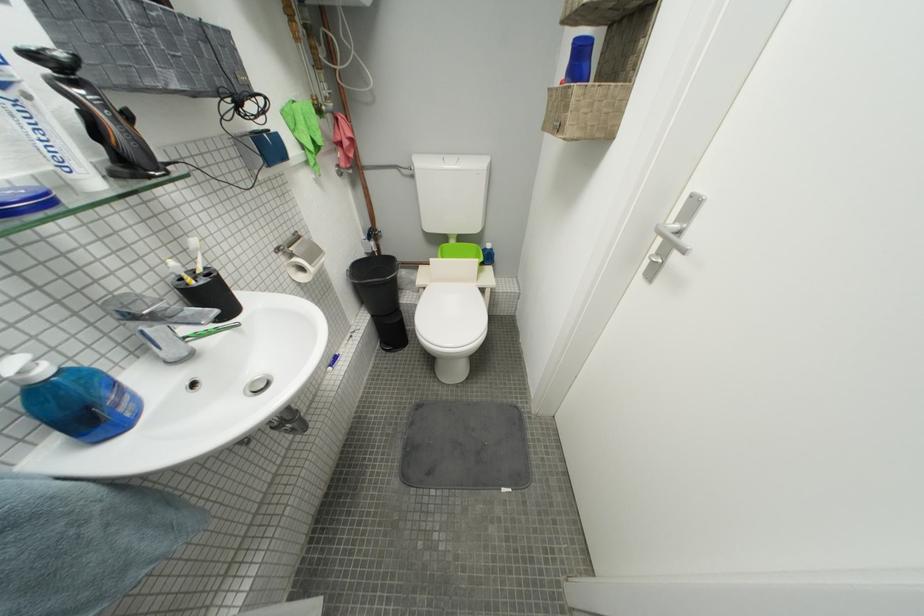
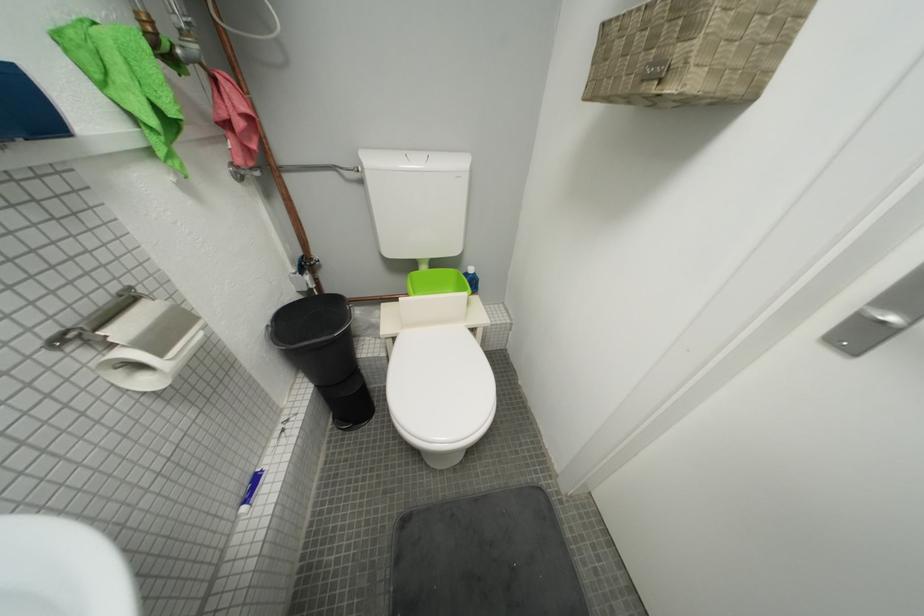
Question: The images are taken continuously from a first-person perspective. In which direction are you moving?

Choices:
 (A) Left
 (B) Right
 (C) Forward
 (D) Backward

Answer: (C)